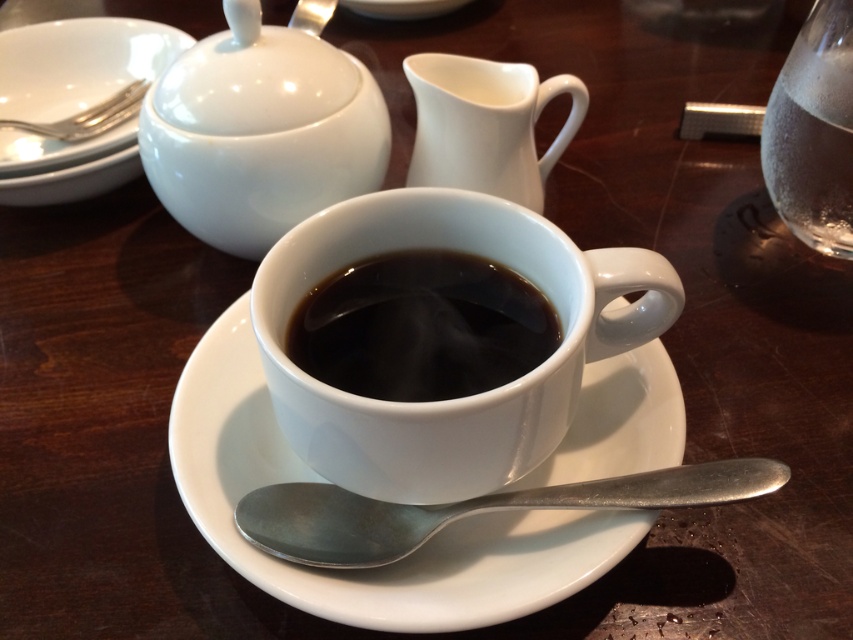
Is white ceramic cup at center further to camera compared to silver metallic spoon at lower center?

No, it is in front of silver metallic spoon at lower center.

Is white ceramic cup at center smaller than silver metallic spoon at lower center?

Incorrect, white ceramic cup at center is not smaller in size than silver metallic spoon at lower center.

At what (x,y) coordinates should I click in order to perform the action: click on white ceramic cup at center. Please return your answer as a coordinate pair (x, y). This screenshot has height=640, width=853. Looking at the image, I should click on (451, 400).

Who is more forward, (335, 348) or (62, 125)?

Positioned in front is point (335, 348).

Does point (422, 364) lie in front of point (114, 100)?

Yes, point (422, 364) is closer to viewer.

Who is more distant from viewer, (444, 324) or (0, 120)?

The point (0, 120) is more distant.

What are the coordinates of `black glossy cup at center` in the screenshot? It's located at (421, 326).

From the picture: Does silver metallic spoon at lower center come in front of white glossy creamer at upper center?

Yes.

Is silver metallic spoon at lower center above white glossy creamer at upper center?

Actually, silver metallic spoon at lower center is below white glossy creamer at upper center.

Locate an element on the screen. The image size is (853, 640). silver metallic spoon at lower center is located at coordinates (469, 509).

Where is `silver metallic spoon at lower center`? The height and width of the screenshot is (640, 853). silver metallic spoon at lower center is located at coordinates (469, 509).